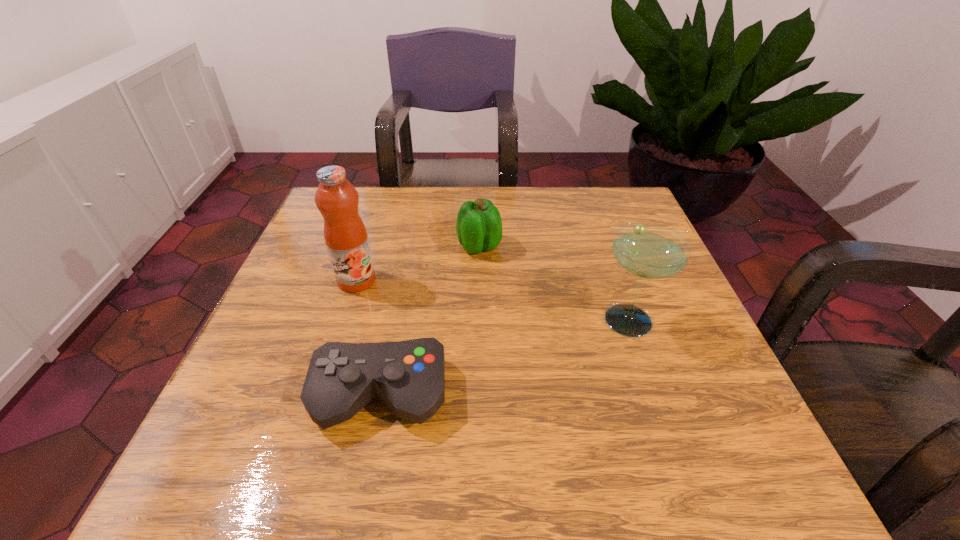
At what (x,y) coordinates should I click in order to perform the action: click on free space between the tallest object and the third shortest object. Please return your answer as a coordinate pair (x, y). Looking at the image, I should click on (494, 300).

This screenshot has width=960, height=540. In order to click on vacant area that lies between the fruit juice and the second tallest object in this screenshot , I will do `click(494, 300)`.

At what (x,y) coordinates should I click in order to perform the action: click on free space between the rightmost object and the second object from right to left. Please return your answer as a coordinate pair (x, y). Looking at the image, I should click on (556, 283).

I want to click on empty space that is in between the fruit juice and the farthest object, so click(418, 263).

At what (x,y) coordinates should I click in order to perform the action: click on object that stands as the third closest to the control. Please return your answer as a coordinate pair (x, y). Looking at the image, I should click on (648, 250).

Identify the location of the second closest object to the shortest object. The width and height of the screenshot is (960, 540). (479, 226).

Identify the location of blank area in the image that satisfies the following two spatial constraints: 1. on the front label of the third nearest object; 2. on the right side of the control. Image resolution: width=960 pixels, height=540 pixels. (321, 395).

I want to click on free space that satisfies the following two spatial constraints: 1. on the front label of the second farthest object; 2. on the left side of the martini, so [344, 320].

Locate an element on the screen. The width and height of the screenshot is (960, 540). free space that satisfies the following two spatial constraints: 1. on the front side of the martini; 2. on the right side of the bell pepper is located at coordinates (479, 320).

Image resolution: width=960 pixels, height=540 pixels. I want to click on blank area in the image that satisfies the following two spatial constraints: 1. on the back side of the second object from right to left; 2. on the left side of the control, so click(x=410, y=246).